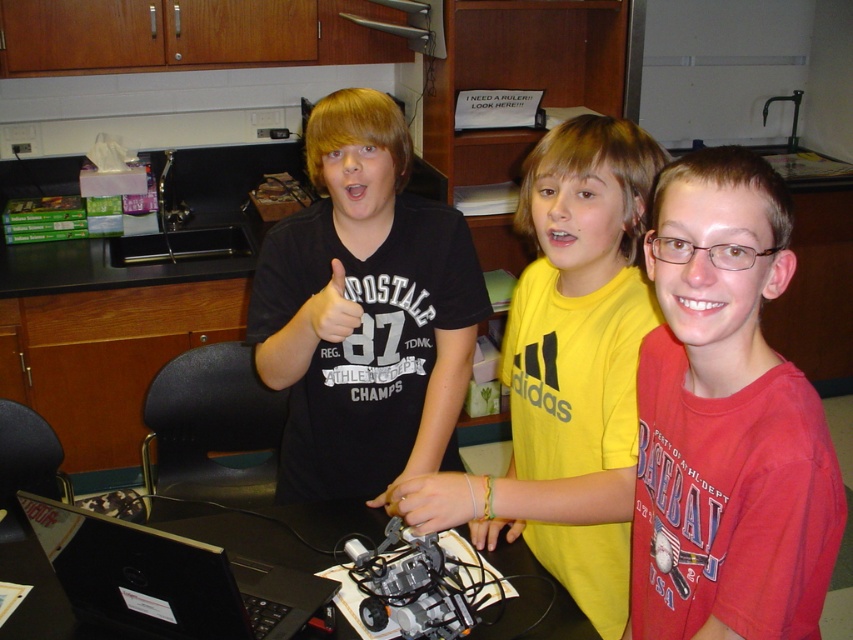
Can you confirm if matte red t-shirt at center is positioned to the left of black matte laptop at lower left?

In fact, matte red t-shirt at center is to the right of black matte laptop at lower left.

Is matte red t-shirt at center bigger than black matte laptop at lower left?

Indeed, matte red t-shirt at center has a larger size compared to black matte laptop at lower left.

Who is more distant from viewer, (708, 452) or (187, 621)?

The point (187, 621) is more distant.

Identify the location of matte red t-shirt at center. The width and height of the screenshot is (853, 640). tap(726, 420).

Is yellow matte shirt at center further to camera compared to smooth plastic hand at center?

No.

Is yellow matte shirt at center to the right of smooth plastic hand at center from the viewer's perspective?

Indeed, yellow matte shirt at center is positioned on the right side of smooth plastic hand at center.

Locate an element on the screen. yellow matte shirt at center is located at coordinates (578, 356).

Does point (305, 372) come farther from viewer compared to point (107, 518)?

Yes, point (305, 372) is behind point (107, 518).

Between black matte shirt at center and black matte laptop at lower left, which one appears on the right side from the viewer's perspective?

black matte shirt at center is more to the right.

Who is more distant from viewer, (395, 246) or (320, 588)?

Positioned behind is point (395, 246).

You are a GUI agent. You are given a task and a screenshot of the screen. Output one action in this format:
    pyautogui.click(x=<x>, y=<y>)
    Task: Click on the black matte shirt at center
    This screenshot has height=640, width=853.
    Given the screenshot: What is the action you would take?
    pyautogui.click(x=366, y=310)